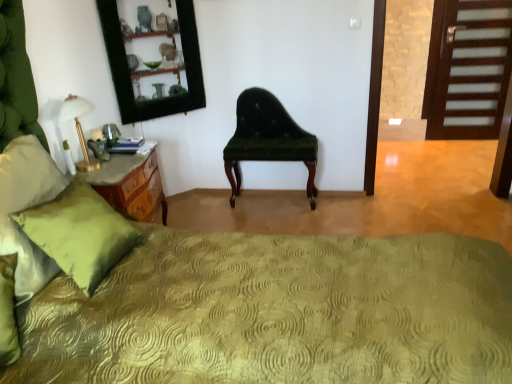
Identify the location of free point to the right of white glass table lamp at left. The width and height of the screenshot is (512, 384). tap(116, 166).